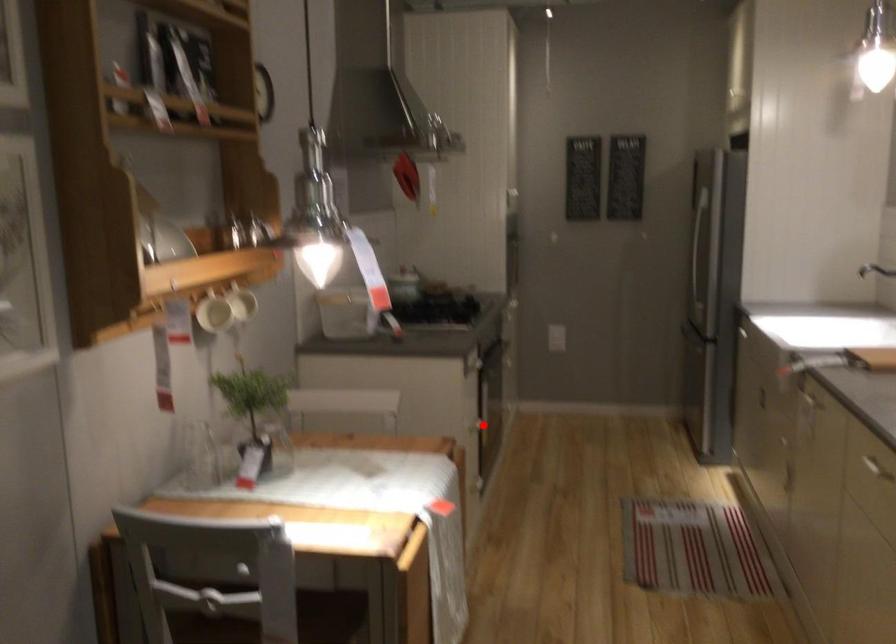
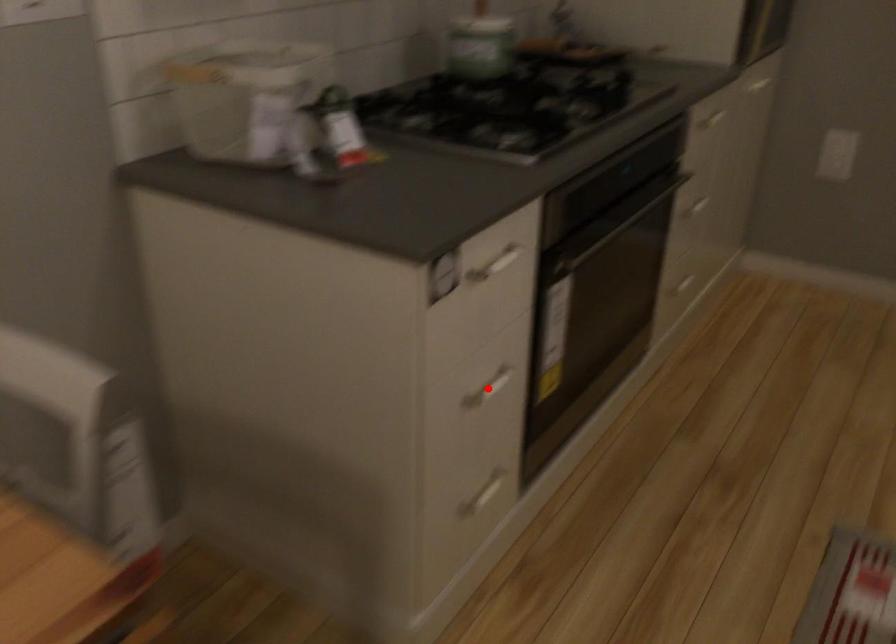
I am providing you with two images of the same scene from different viewpoints. A red point is marked on the first image and another point is marked on the second image. Are the points marked in image1 and image2 representing the same 3D position?

Yes